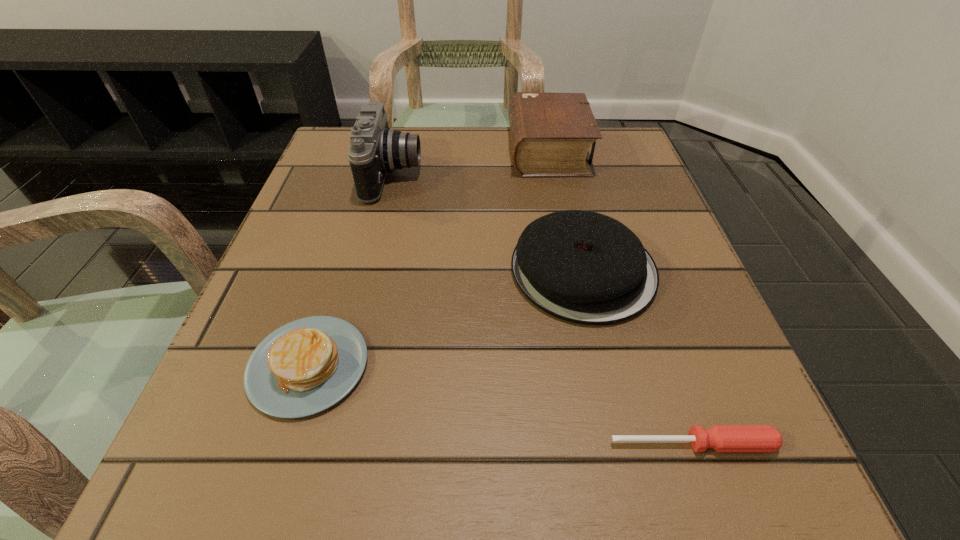
Where is `vacant space at the near left corner of the desktop`? The image size is (960, 540). vacant space at the near left corner of the desktop is located at coordinates (184, 512).

Where is `vacant region at the near right corner of the desktop`? The height and width of the screenshot is (540, 960). vacant region at the near right corner of the desktop is located at coordinates (648, 474).

The image size is (960, 540). What are the coordinates of `empty location between the fourth shortest object and the left pancake` in the screenshot? It's located at (428, 258).

Image resolution: width=960 pixels, height=540 pixels. Identify the location of free spot between the left pancake and the second tallest object. (428, 258).

At what (x,y) coordinates should I click in order to perform the action: click on empty space between the screwdriver and the third shortest object. Please return your answer as a coordinate pair (x, y). Looking at the image, I should click on (637, 357).

This screenshot has width=960, height=540. What are the coordinates of `vacant space that is in between the shorter pancake and the taller pancake` in the screenshot? It's located at (445, 318).

Locate an element on the screen. empty space that is in between the Bible and the camera is located at coordinates coord(470,163).

The image size is (960, 540). I want to click on blank region between the Bible and the fourth tallest object, so click(428, 258).

What are the coordinates of `free space between the shorter pancake and the screwdriver` in the screenshot? It's located at (500, 404).

Locate an element on the screen. This screenshot has width=960, height=540. object that stands as the closest to the tallest object is located at coordinates (584, 267).